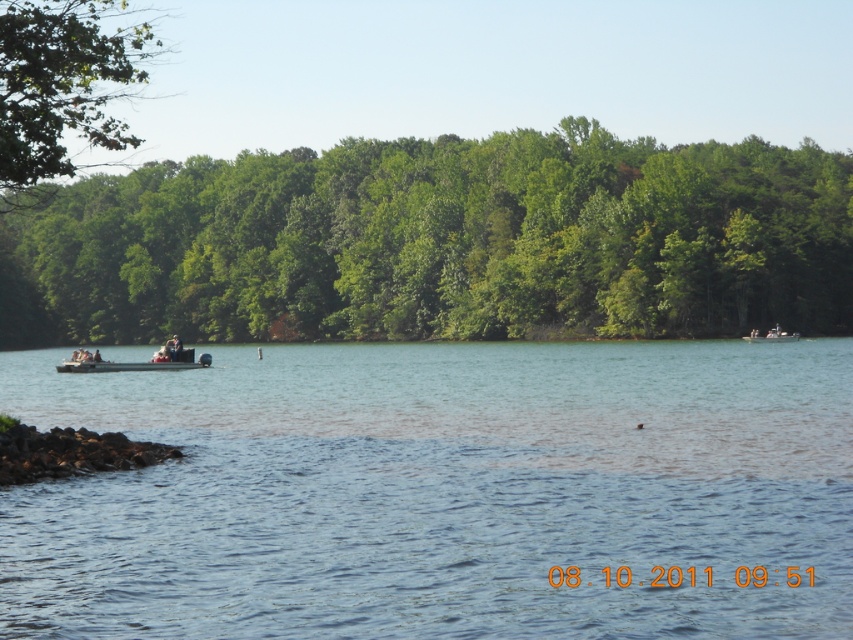
Is point (770, 227) in front of point (74, 61)?

No.

Is green leafy trees at center positioned at the back of green leafy tree at upper left?

Yes.

This screenshot has width=853, height=640. What do you see at coordinates (438, 243) in the screenshot? I see `green leafy trees at center` at bounding box center [438, 243].

Identify the location of green leafy trees at center. (438, 243).

From the picture: Is the position of clear blue water at center less distant than that of metallic gray pontoon boat at left?

Yes.

Between clear blue water at center and metallic gray pontoon boat at left, which one is positioned lower?

clear blue water at center is below.

This screenshot has width=853, height=640. Describe the element at coordinates (442, 492) in the screenshot. I see `clear blue water at center` at that location.

In order to click on clear blue water at center in this screenshot , I will do `click(442, 492)`.

Find the location of a particular element. The width and height of the screenshot is (853, 640). clear blue water at center is located at coordinates (442, 492).